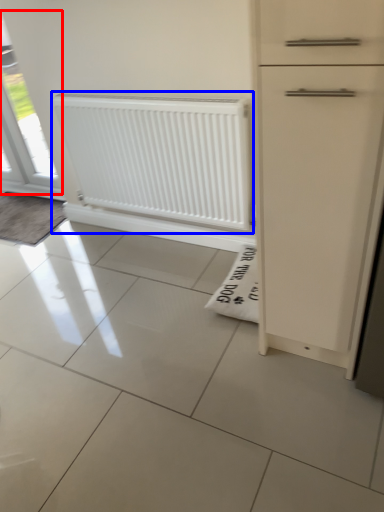
Question: Which object is further to the camera taking this photo, window (highlighted by a red box) or radiator (highlighted by a blue box)?

Choices:
 (A) window
 (B) radiator

Answer: (A)